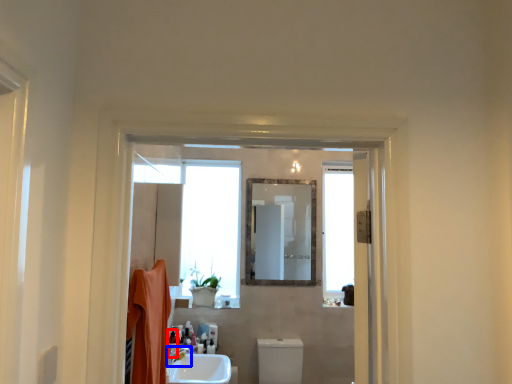
Question: Which point is further to the camera, toiletry (highlighted by a red box) or tap (highlighted by a blue box)?

Choices:
 (A) toiletry
 (B) tap

Answer: (A)